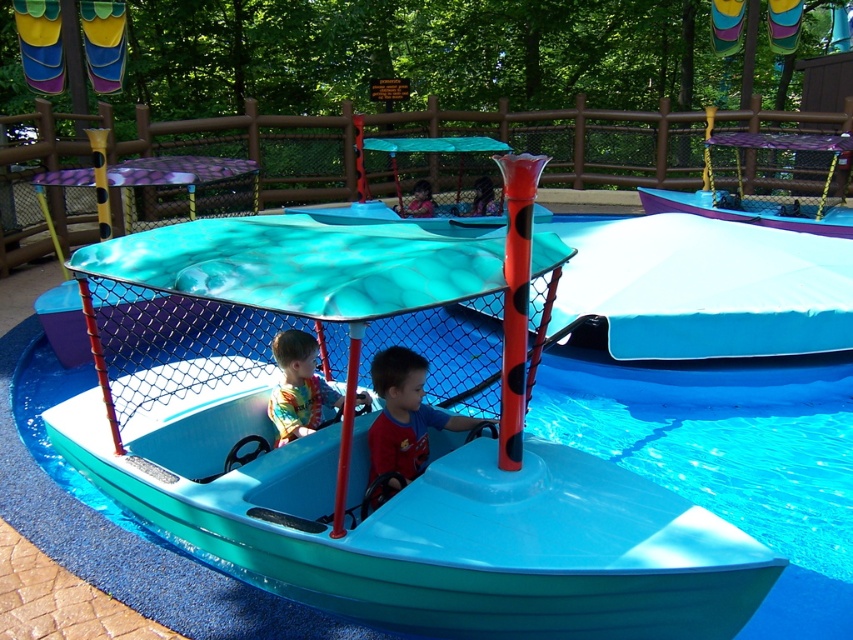
Question: Observing the image, what is the correct spatial positioning of red shirt at center in reference to matte blue shirt at center?

Choices:
 (A) left
 (B) right

Answer: (B)

Question: Which point is farther to the camera?

Choices:
 (A) (419, 216)
 (B) (389, 422)

Answer: (A)

Question: Which point appears farthest from the camera in this image?

Choices:
 (A) (428, 216)
 (B) (294, 355)
 (C) (397, 424)

Answer: (A)

Question: Which point is closer to the camera taking this photo?

Choices:
 (A) (416, 205)
 (B) (368, 444)
 (C) (309, 342)

Answer: (B)

Question: Is red shirt at center smaller than matte blue shirt at center?

Choices:
 (A) no
 (B) yes

Answer: (A)

Question: Can you confirm if red shirt at center is thinner than matte blue shirt at center?

Choices:
 (A) no
 (B) yes

Answer: (A)